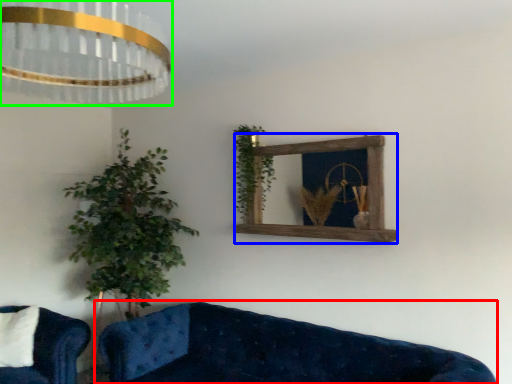
Question: Estimate the real-world distances between objects in this image. Which object is closer to studio couch (highlighted by a red box), window frame (highlighted by a blue box) or lamp (highlighted by a green box)?

Choices:
 (A) window frame
 (B) lamp

Answer: (A)